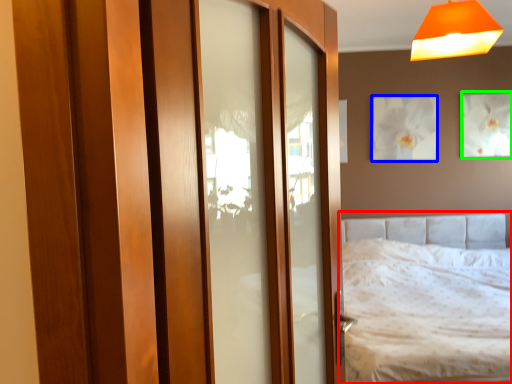
Question: Which is nearer to the bed (highlighted by a red box)? picture frame (highlighted by a blue box) or picture frame (highlighted by a green box).

Choices:
 (A) picture frame
 (B) picture frame

Answer: (A)